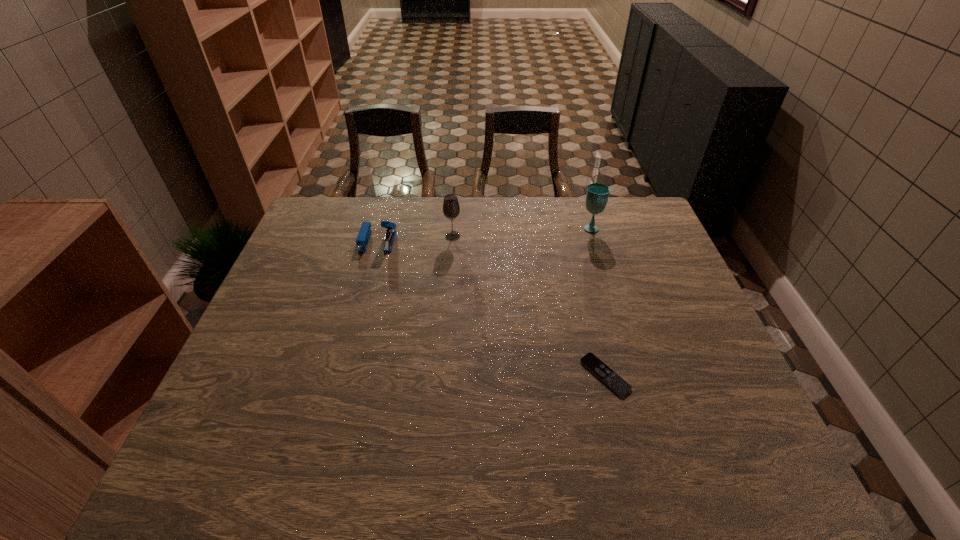
The width and height of the screenshot is (960, 540). Find the location of `the right glass drink container`. the right glass drink container is located at coordinates (597, 195).

Locate an element on the screen. the left glass drink container is located at coordinates (451, 209).

Locate an element on the screen. The image size is (960, 540). stapler is located at coordinates (364, 234).

The image size is (960, 540). Identify the location of the second shortest object. click(364, 234).

Locate an element on the screen. the nearest object is located at coordinates 595,365.

Image resolution: width=960 pixels, height=540 pixels. I want to click on remote control, so pyautogui.click(x=595, y=365).

Find the location of a particular element. The width and height of the screenshot is (960, 540). free space located on the front of the right glass drink container is located at coordinates (602, 264).

Image resolution: width=960 pixels, height=540 pixels. Identify the location of vacant space positioned on the right of the second object from left to right. (479, 236).

At what (x,y) coordinates should I click in order to perform the action: click on vacant space located on the left of the leftmost object. Please return your answer as a coordinate pair (x, y). The width and height of the screenshot is (960, 540). Looking at the image, I should click on (302, 241).

Locate an element on the screen. free space located on the left of the remote control is located at coordinates (498, 375).